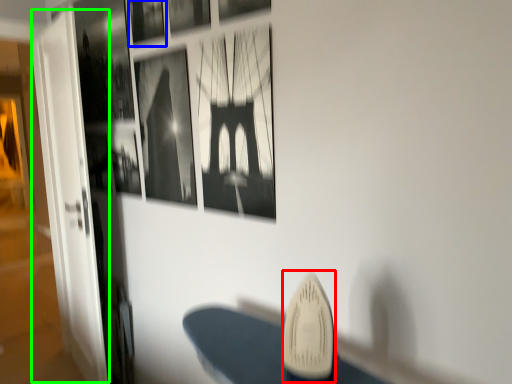
Question: Which object is the closest to the surfboard (highlighted by a red box)? Choose among these: picture frame (highlighted by a blue box) or glass door (highlighted by a green box).

Choices:
 (A) picture frame
 (B) glass door

Answer: (A)